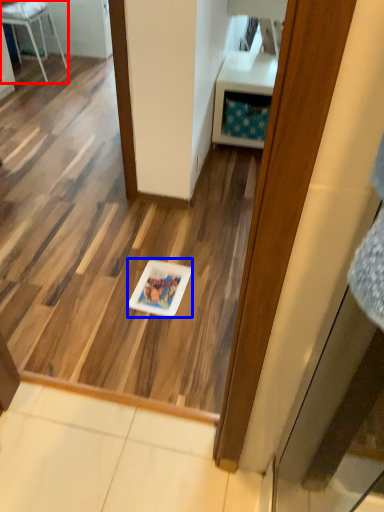
Question: Which point is closer to the camera, furniture (highlighted by a red box) or glass plate (highlighted by a blue box)?

Choices:
 (A) furniture
 (B) glass plate

Answer: (B)